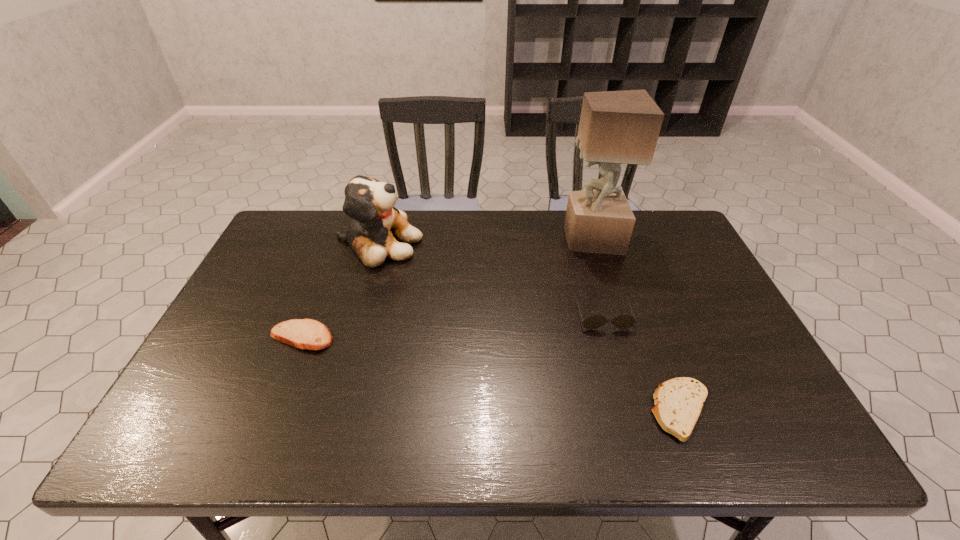
At what (x,y) coordinates should I click in order to perform the action: click on vacant space at the far left corner of the desktop. Please return your answer as a coordinate pair (x, y). Looking at the image, I should click on (305, 211).

Where is `vacant space at the far right corner of the desktop`? The width and height of the screenshot is (960, 540). vacant space at the far right corner of the desktop is located at coordinates (656, 218).

Locate an element on the screen. The width and height of the screenshot is (960, 540). vacant area that lies between the sculpture and the third shortest object is located at coordinates (597, 277).

Identify the location of vacant area that lies between the fourth shortest object and the tallest object. (485, 241).

Find the location of a particular element. vacant space that is in between the farther pita bread and the sunglasses is located at coordinates (452, 326).

The width and height of the screenshot is (960, 540). Find the location of `free point between the tallest object and the nearest object`. free point between the tallest object and the nearest object is located at coordinates (636, 325).

Identify the location of free space between the sculpture and the shorter pita bread. The height and width of the screenshot is (540, 960). (636, 325).

At what (x,y) coordinates should I click in order to perform the action: click on vacant area between the sunglasses and the tallest object. Please return your answer as a coordinate pair (x, y). The height and width of the screenshot is (540, 960). Looking at the image, I should click on click(x=597, y=277).

Find the location of `free space between the second tallest object and the sunglasses`. free space between the second tallest object and the sunglasses is located at coordinates (491, 279).

This screenshot has height=540, width=960. Identify the location of vacant space that is in between the third tallest object and the second tallest object. (491, 279).